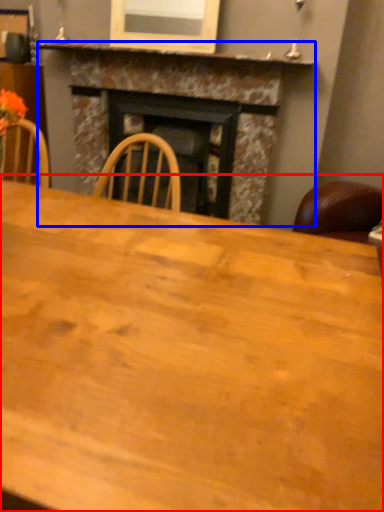
Question: Which object is further to the camera taking this photo, table (highlighted by a red box) or fireplace (highlighted by a blue box)?

Choices:
 (A) table
 (B) fireplace

Answer: (B)